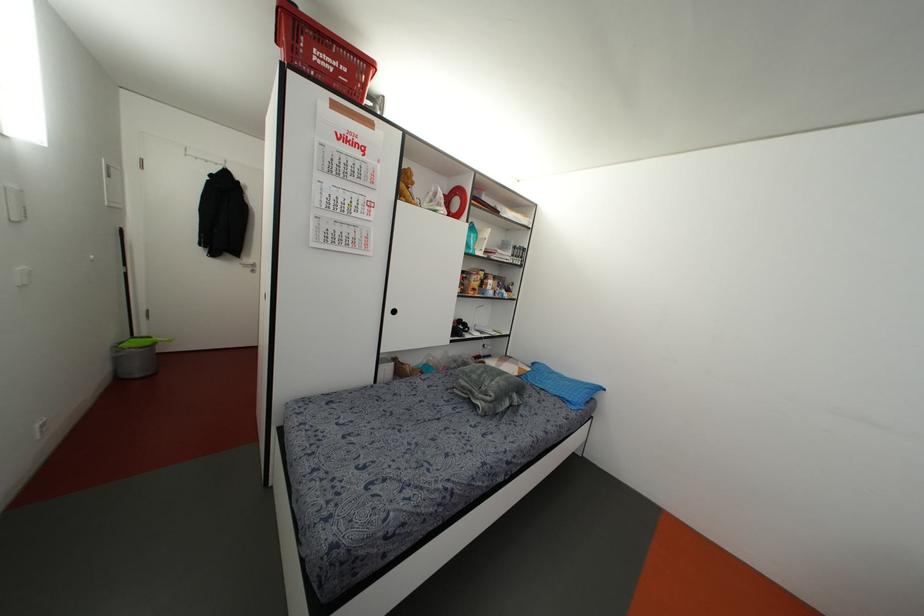
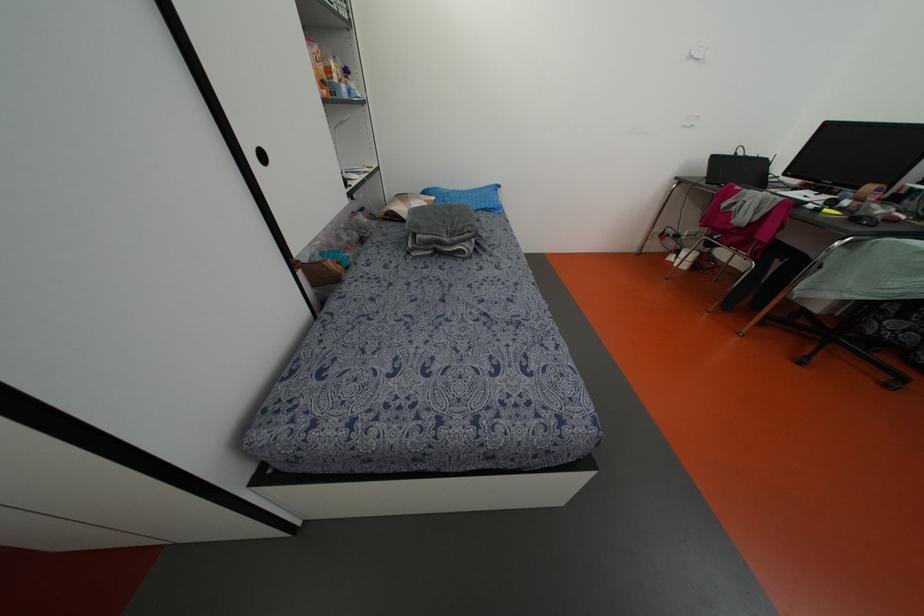
In the second image, find the point that corresponds to point (459, 379) in the first image.

(418, 236)